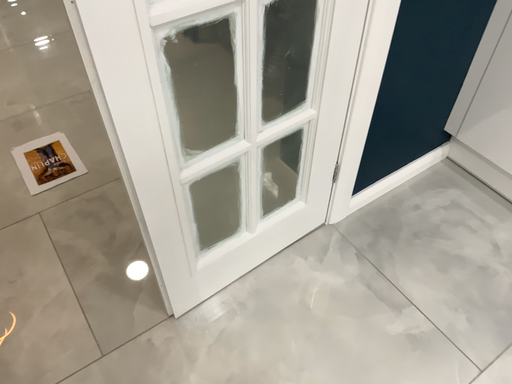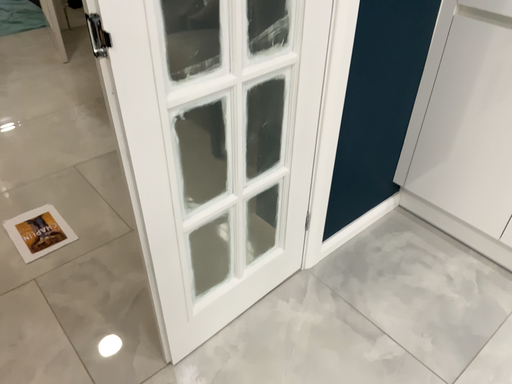
Question: How did the camera likely rotate when shooting the video?

Choices:
 (A) rotated upward
 (B) rotated downward

Answer: (A)